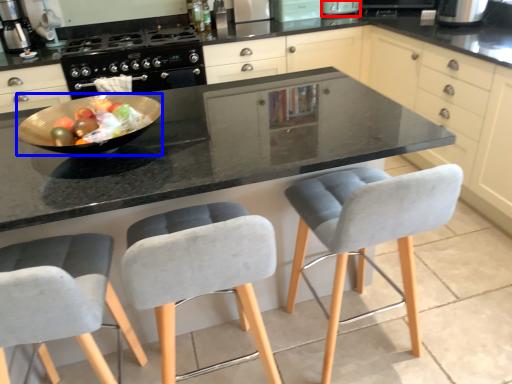
Question: Among these objects, which one is farthest to the camera, appliance (highlighted by a red box) or bowl (highlighted by a blue box)?

Choices:
 (A) appliance
 (B) bowl

Answer: (A)